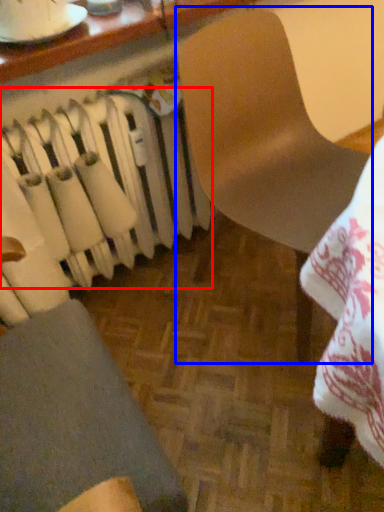
Question: Which point is closer to the camera, radiator (highlighted by a red box) or chair (highlighted by a blue box)?

Choices:
 (A) radiator
 (B) chair

Answer: (B)